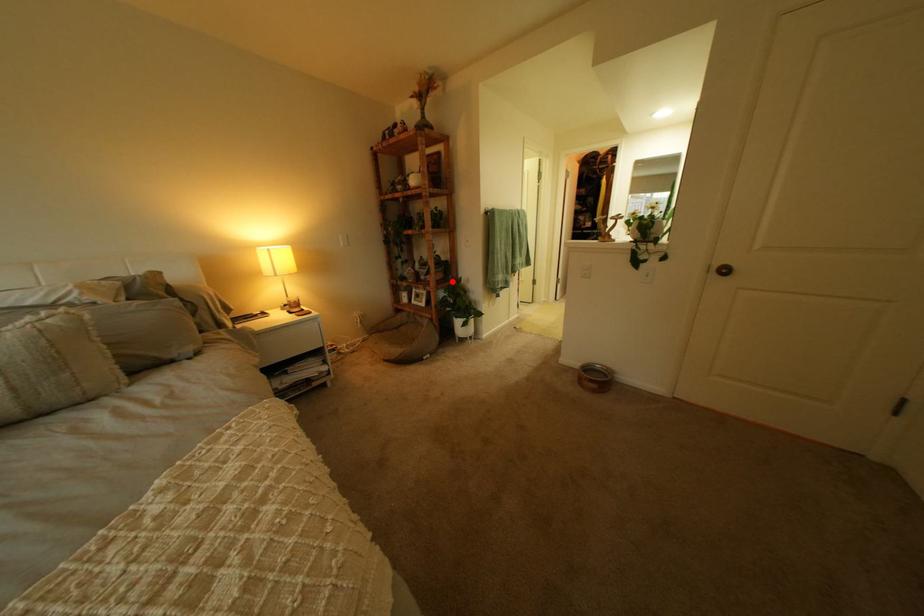
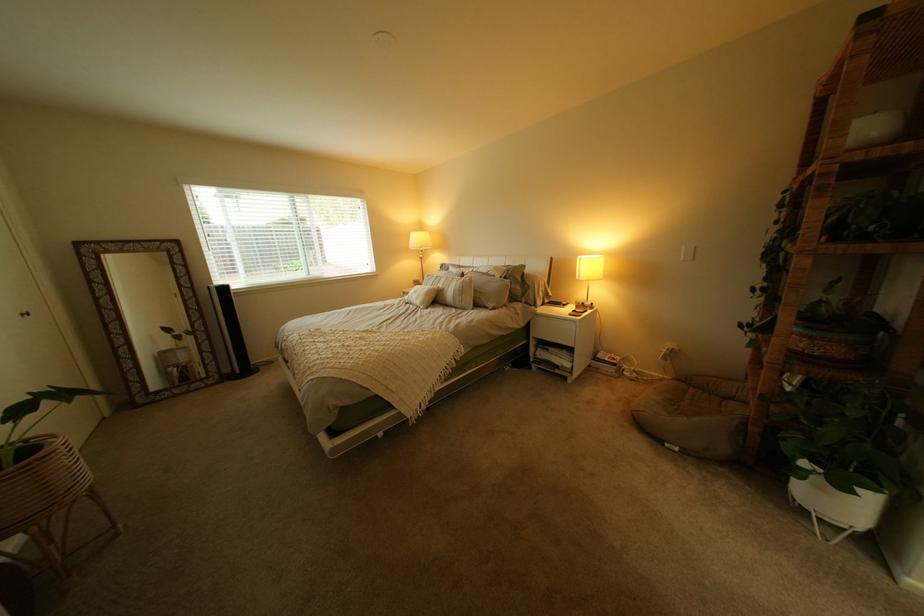
Question: I am providing you with two images of the same scene from different viewpoints. A red point is shown in image1. For the corresponding object point in image2, is it positioned nearer or farther from the camera?

Choices:
 (A) Nearer
 (B) Farther

Answer: (B)